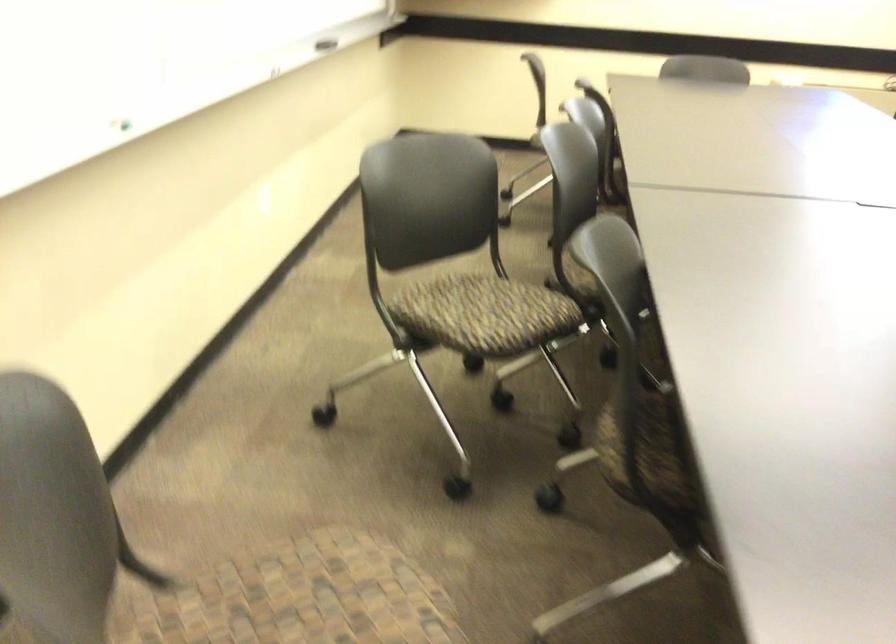
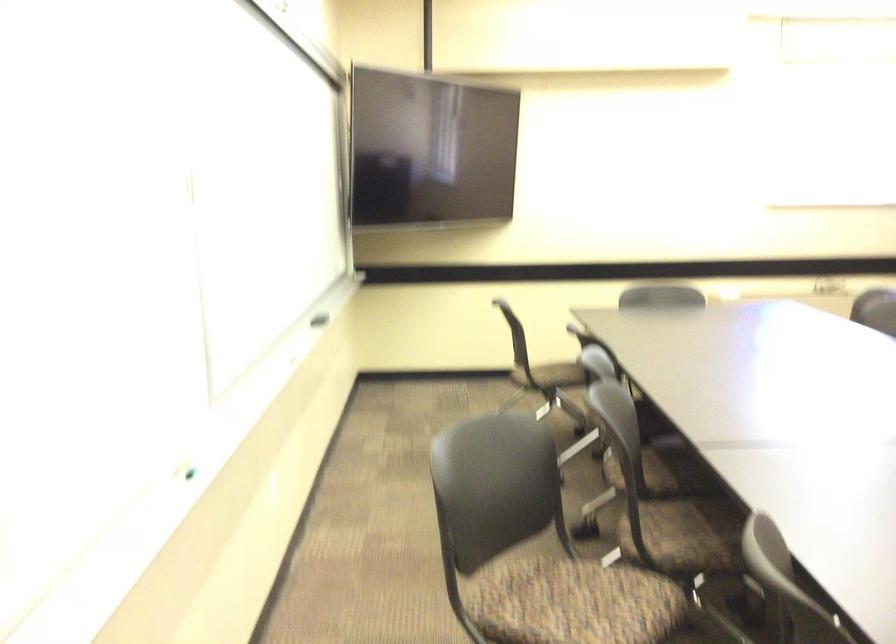
What movement of the cameraman would produce the second image?

The cameraman walked toward left, forward.